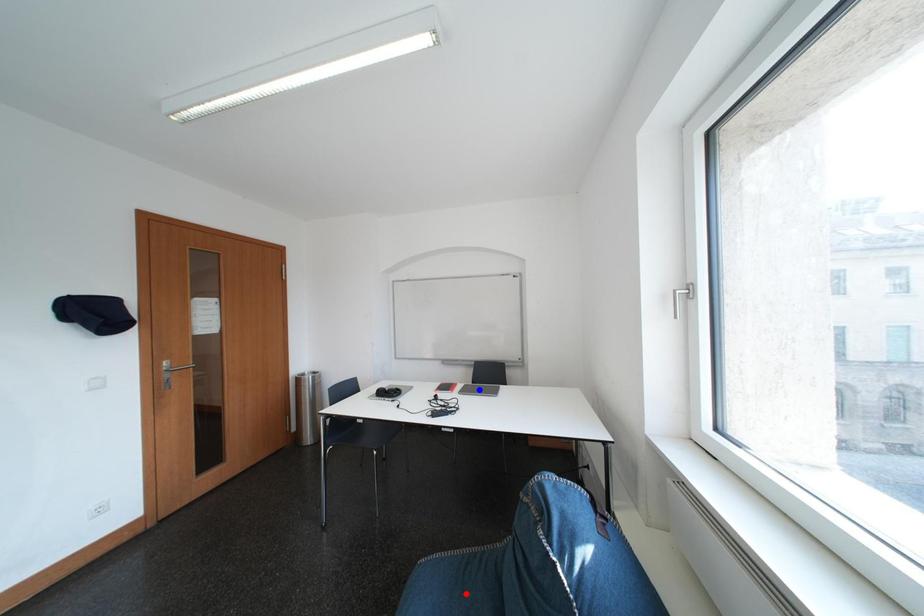
Question: In the image, two points are highlighted. Which point is nearer to the camera? Reply with the corresponding letter.

Choices:
 (A) blue point
 (B) red point

Answer: (B)